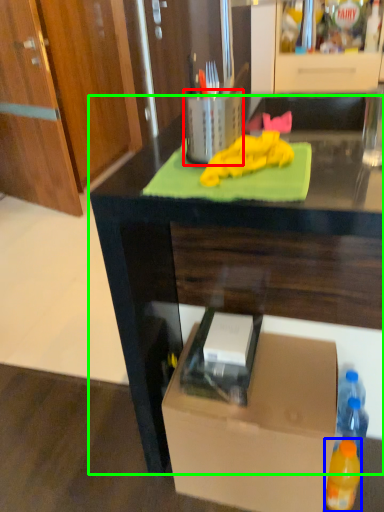
Question: Which object is the closest to the appliance (highlighted by a red box)? Choose among these: bottle (highlighted by a blue box) or desk (highlighted by a green box).

Choices:
 (A) bottle
 (B) desk

Answer: (B)